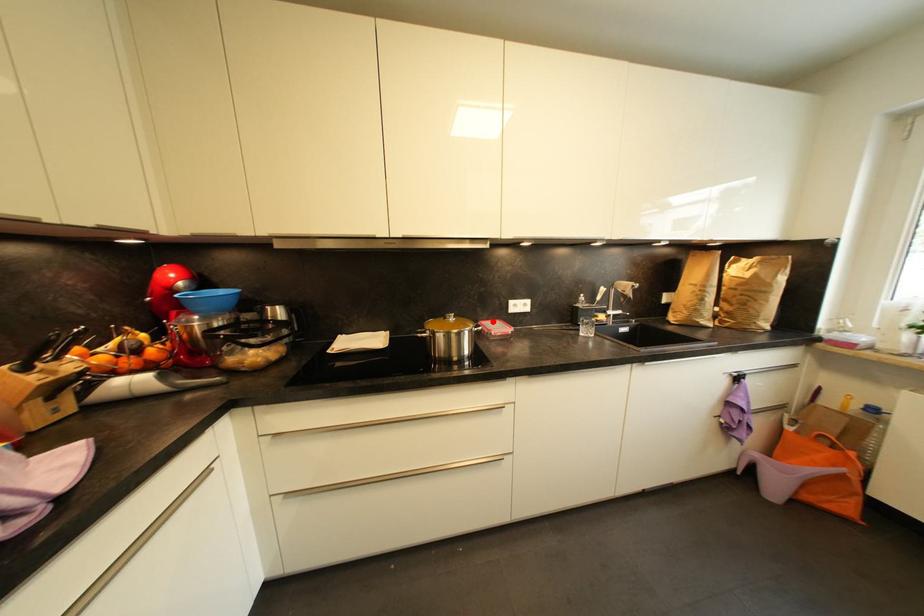
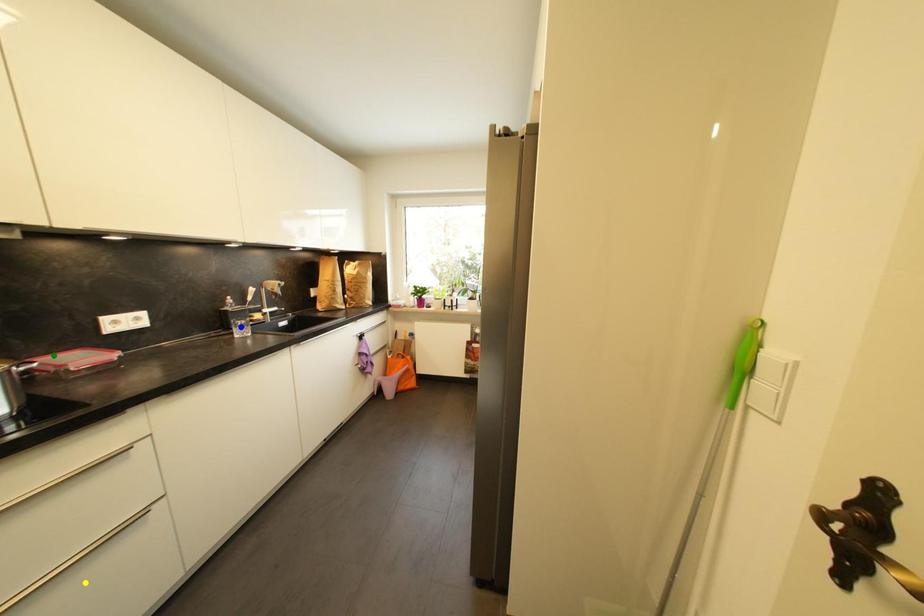
Question: I am providing you with two images of the same scene from different viewpoints. A red point is marked on the first image. You are given multiple points on the second image. Which spot in image 2 lines up with the point in image 1?

Choices:
 (A) yellow point
 (B) green point
 (C) blue point

Answer: (B)